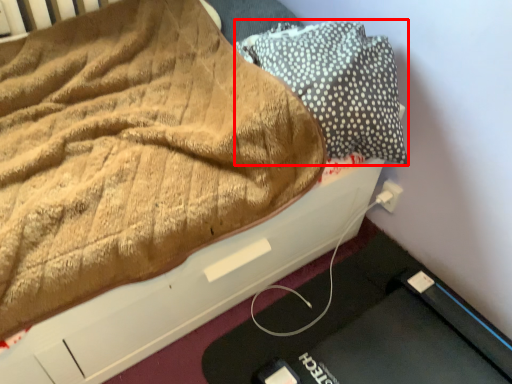
Question: Considering the relative positions of pillow (annotated by the red box) and electric outlet in the image provided, where is pillow (annotated by the red box) located with respect to the staircase?

Choices:
 (A) left
 (B) right

Answer: (A)